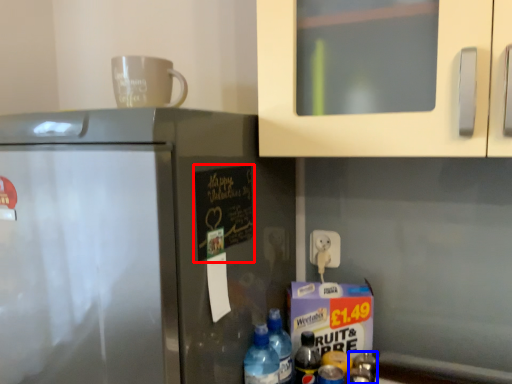
Question: Among these objects, which one is nearest to the camera, bulletin board (highlighted by a red box) or bottle (highlighted by a blue box)?

Choices:
 (A) bulletin board
 (B) bottle

Answer: (A)